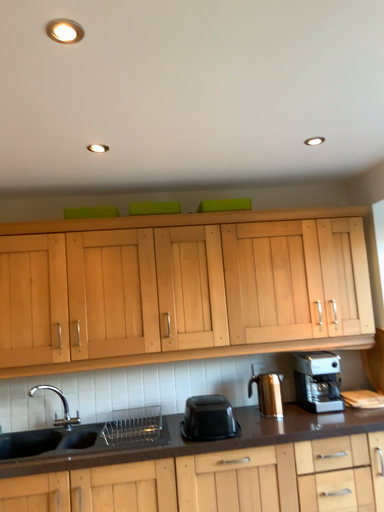
Question: Is black matte sink at lower left positioned behind black plastic container at center?

Choices:
 (A) no
 (B) yes

Answer: (A)

Question: Can we say black matte sink at lower left lies outside black plastic container at center?

Choices:
 (A) no
 (B) yes

Answer: (B)

Question: Is black plastic container at center at the back of black matte sink at lower left?

Choices:
 (A) yes
 (B) no

Answer: (B)

Question: Is black matte sink at lower left wider than black plastic container at center?

Choices:
 (A) no
 (B) yes

Answer: (B)

Question: Are black matte sink at lower left and black plastic container at center beside each other?

Choices:
 (A) no
 (B) yes

Answer: (A)

Question: Is black matte sink at lower left bigger than black plastic container at center?

Choices:
 (A) no
 (B) yes

Answer: (B)

Question: Is the position of silver metallic coffee maker at lower right less distant than that of black matte sink at lower left?

Choices:
 (A) yes
 (B) no

Answer: (B)

Question: Is silver metallic coffee maker at lower right oriented away from black matte sink at lower left?

Choices:
 (A) no
 (B) yes

Answer: (A)

Question: Does silver metallic coffee maker at lower right turn towards black matte sink at lower left?

Choices:
 (A) yes
 (B) no

Answer: (B)

Question: Is silver metallic coffee maker at lower right bigger than black matte sink at lower left?

Choices:
 (A) no
 (B) yes

Answer: (A)

Question: Is silver metallic coffee maker at lower right not within black matte sink at lower left?

Choices:
 (A) yes
 (B) no

Answer: (A)

Question: Can you confirm if silver metallic coffee maker at lower right is smaller than black matte sink at lower left?

Choices:
 (A) yes
 (B) no

Answer: (A)

Question: Is shiny metallic coffee maker at right wider than black matte sink at lower left?

Choices:
 (A) yes
 (B) no

Answer: (B)